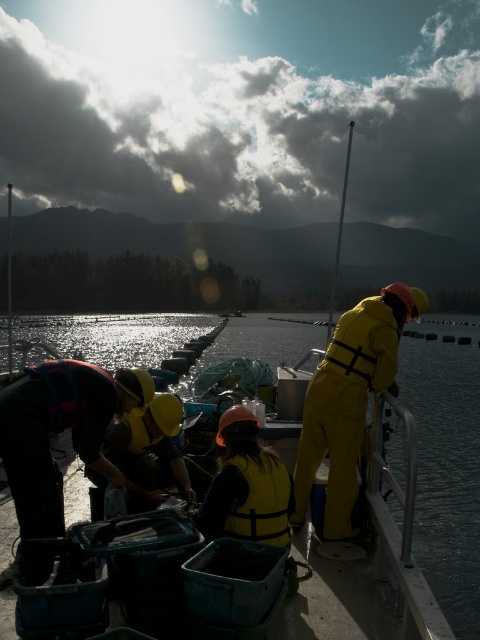
Question: Which is farther from the yellow reflective vest at lower left?

Choices:
 (A) yellow matte life vest at center
 (B) clear water at center
 (C) yellow matte safety vest at center
 (D) yellow rubber suit at right

Answer: (B)

Question: Can you confirm if yellow rubber suit at right is positioned below yellow matte life vest at center?

Choices:
 (A) yes
 (B) no

Answer: (B)

Question: Which object is the farthest from the yellow matte life vest at center?

Choices:
 (A) yellow rubber suit at right
 (B) yellow reflective vest at lower left
 (C) clear water at center
 (D) yellow matte safety vest at center

Answer: (C)

Question: Which point is closer to the camera?

Choices:
 (A) (170, 449)
 (B) (252, 320)
 (C) (354, 444)

Answer: (C)

Question: Is yellow matte life vest at center closer to camera compared to yellow matte safety vest at center?

Choices:
 (A) no
 (B) yes

Answer: (A)

Question: Can you confirm if clear water at center is thinner than yellow matte life vest at center?

Choices:
 (A) no
 (B) yes

Answer: (A)